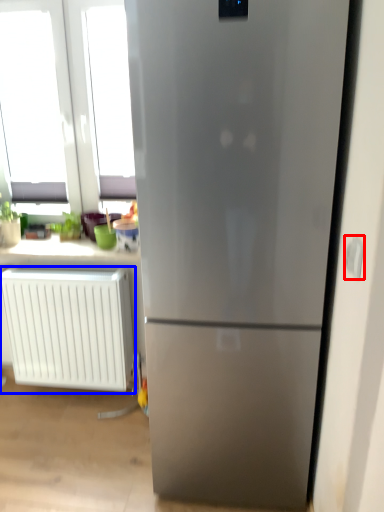
Question: Which object appears closest to the camera in this image, electric outlet (highlighted by a red box) or radiator (highlighted by a blue box)?

Choices:
 (A) electric outlet
 (B) radiator

Answer: (A)